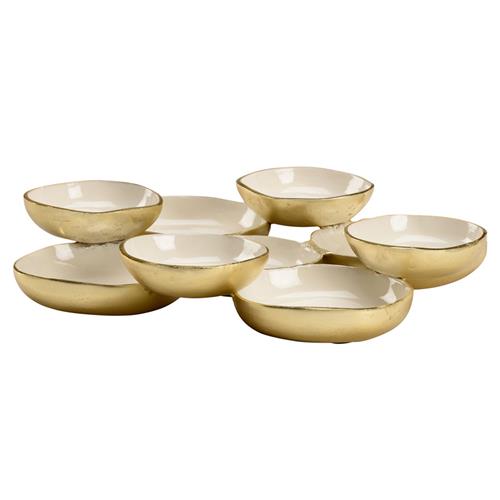
Where is `bowl`? bowl is located at coordinates (65, 273), (161, 263), (332, 281), (395, 250), (317, 188), (198, 212), (101, 199), (287, 249).